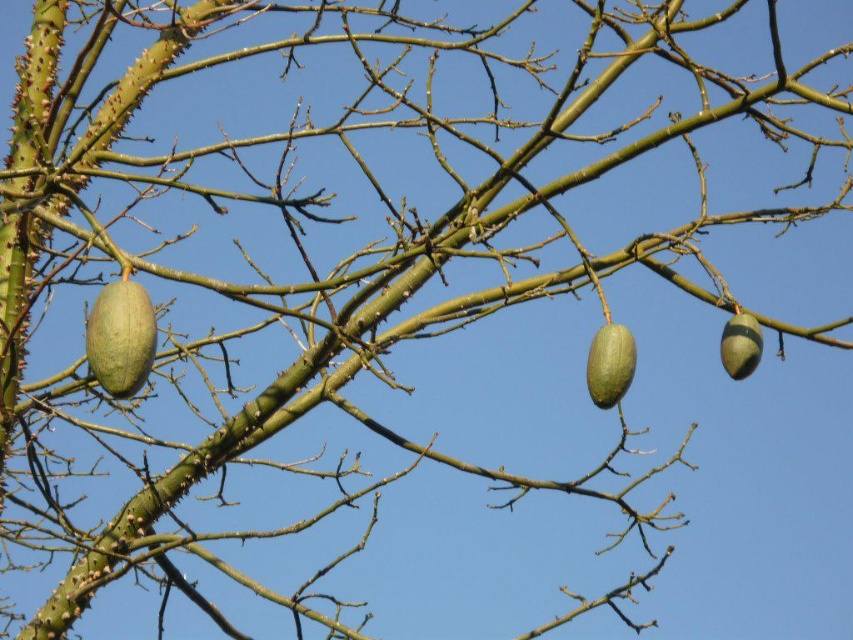
You are standing in front of the tree and notice two points marked on the branches. Which point, point (585, 362) or point (723, 326), is closer to you?

Point (585, 362) is closer to the camera than point (723, 326), so it is closer to you.

You are an orchard worker checking the growth of the green matte fruit at left and the green matte fruit at center. Which fruit has a greater width?

The green matte fruit at left has a greater width than the green matte fruit at center.